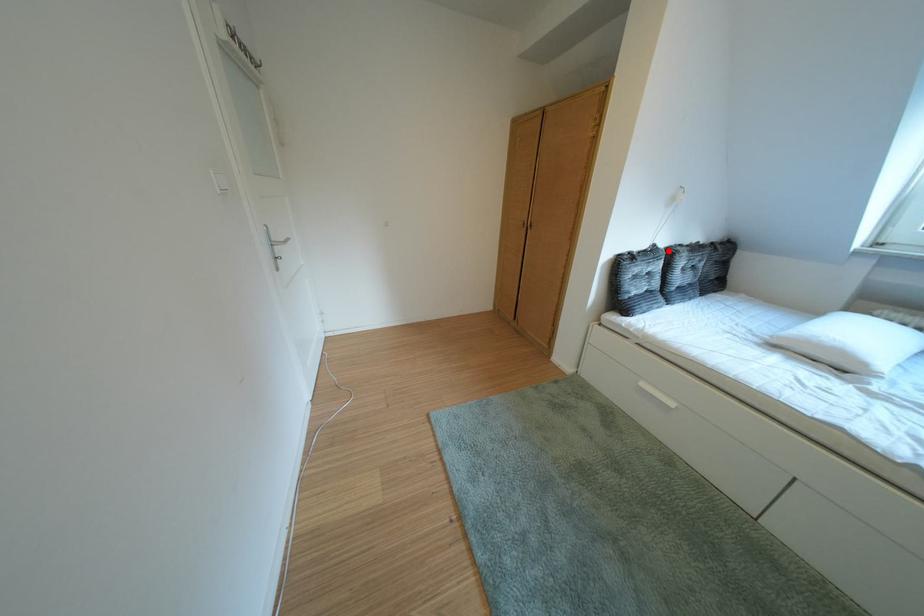
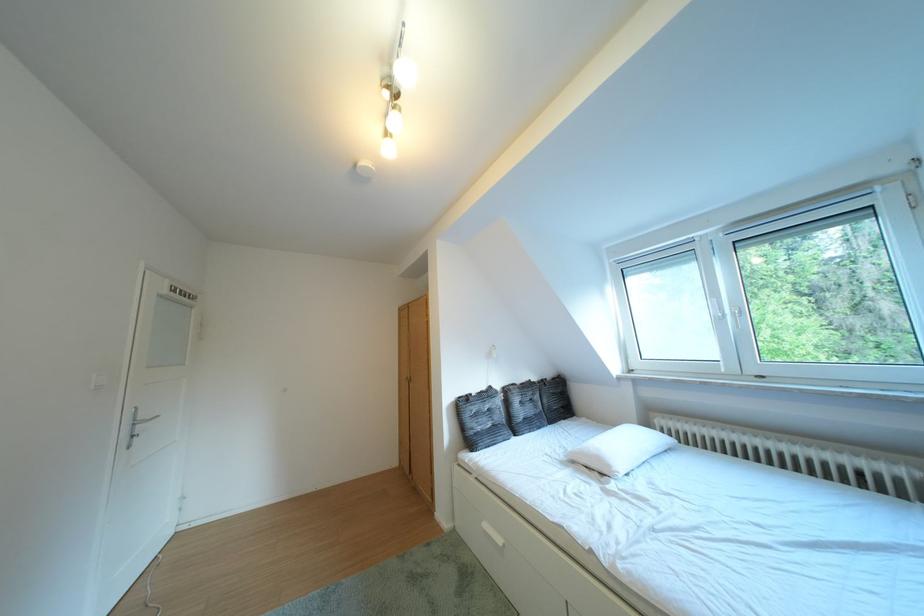
The point at the highlighted location is marked in the first image. Where is the corresponding point in the second image?

(504, 392)